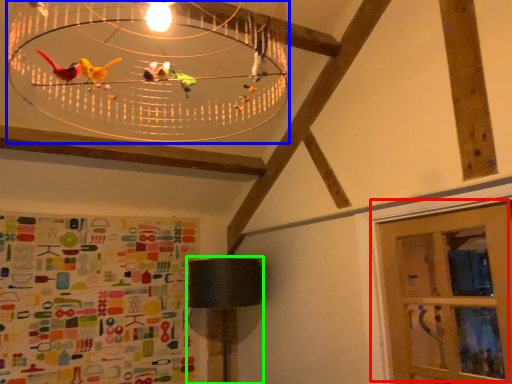
Question: Based on their relative distances, which object is farther from door (highlighted by a red box)? Choose from chandelier (highlighted by a blue box) and table lamp (highlighted by a green box).

Choices:
 (A) chandelier
 (B) table lamp

Answer: (A)